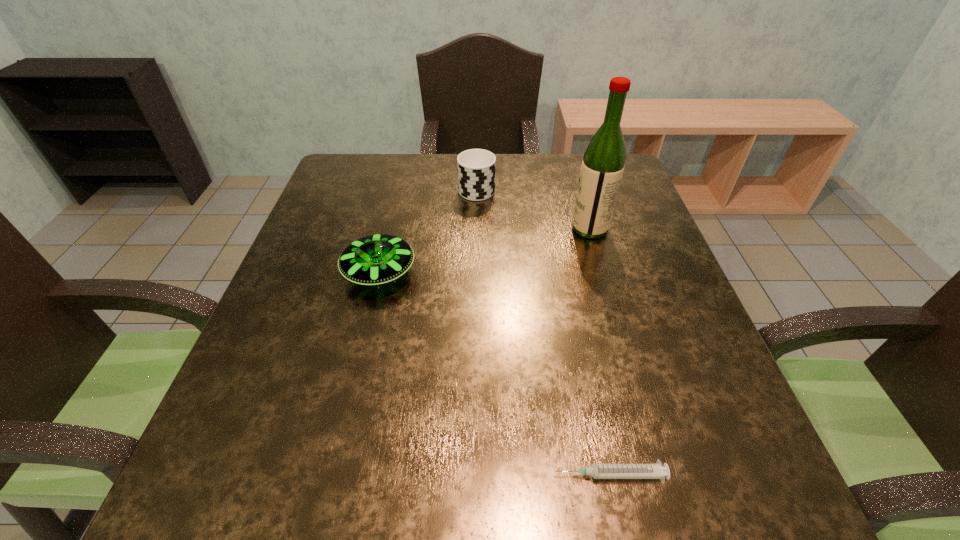
Locate an element on the screen. vacant area located 0.150m on the label of the tallest object is located at coordinates (511, 228).

Locate an element on the screen. The image size is (960, 540). vacant area situated on the side of the second object from left to right with the handle is located at coordinates (477, 163).

Where is `free space located 0.080m on the side of the second object from left to right with the handle`? The width and height of the screenshot is (960, 540). free space located 0.080m on the side of the second object from left to right with the handle is located at coordinates [477, 161].

Where is `free space located on the right of the third tallest object`? free space located on the right of the third tallest object is located at coordinates (578, 272).

The width and height of the screenshot is (960, 540). I want to click on vacant space situated at the needle end of the nearest object, so click(x=493, y=475).

Identify the location of vacant space situated 0.390m at the needle end of the nearest object. (294, 475).

Identify the location of vacant region located 0.400m at the needle end of the nearest object. The height and width of the screenshot is (540, 960). (287, 475).

At what (x,y) coordinates should I click in order to perform the action: click on object that is positioned at the far edge. Please return your answer as a coordinate pair (x, y). Looking at the image, I should click on (476, 168).

At what (x,y) coordinates should I click in order to perform the action: click on object positioned at the near edge. Please return your answer as a coordinate pair (x, y). The width and height of the screenshot is (960, 540). Looking at the image, I should click on (598, 471).

Identify the location of object that is positioned at the left edge. This screenshot has width=960, height=540. (377, 259).